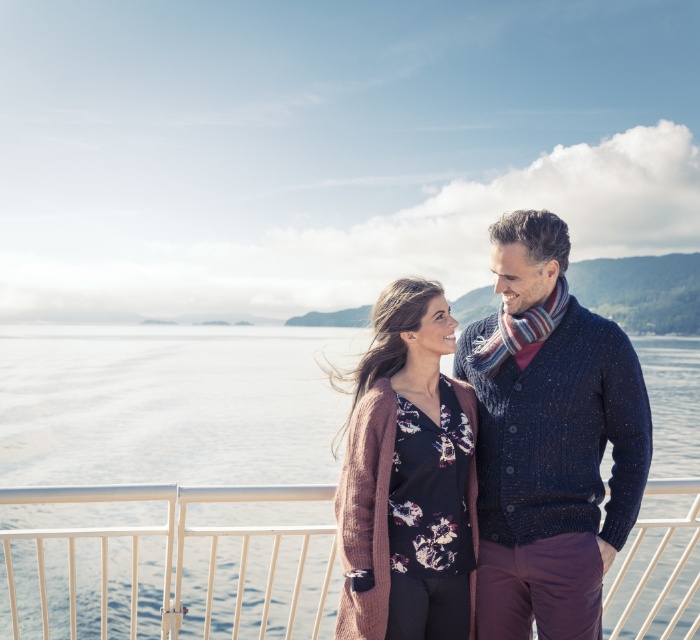
Based on the photo, you are a fashion designer observing two garments in the image. The knitted navy sweater at center and the rustic knit cardigan at center. Which one is bigger in size?

The knitted navy sweater at center is larger in size than the rustic knit cardigan at center.

You are a photographer trying to capture a closeup of the clear water at center without the rustic knit cardigan at center appearing in the background. Is this possible given their positions?

The rustic knit cardigan at center is behind the clear water at center, so it would naturally appear in the background of any shot focused on the clear water at center. Therefore, it is not possible to capture a closeup of the clear water at center without the rustic knit cardigan at center in the background.

You are a photographer planning to take a portrait of the two people in the scene. You want to ensure that both the clear water at center and the rustic knit cardigan at center are visible in the frame. Based on their widths, which object should you position closer to the edge of the frame to avoid overcrowding?

The clear water at center is wider than the rustic knit cardigan at center. To avoid overcrowding, position the clear water at center closer to the edge of the frame since it occupies more space.